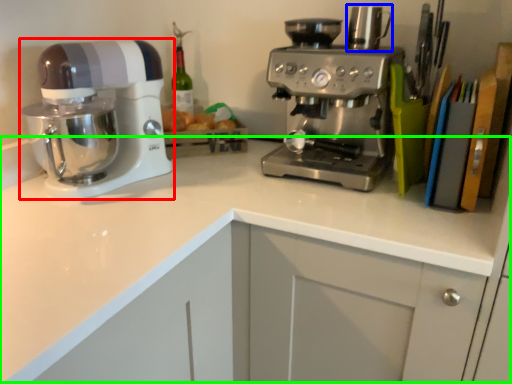
Question: Considering the real-world distances, which object is farthest from mixer (highlighted by a red box)? appliance (highlighted by a blue box) or counter top (highlighted by a green box)?

Choices:
 (A) appliance
 (B) counter top

Answer: (A)